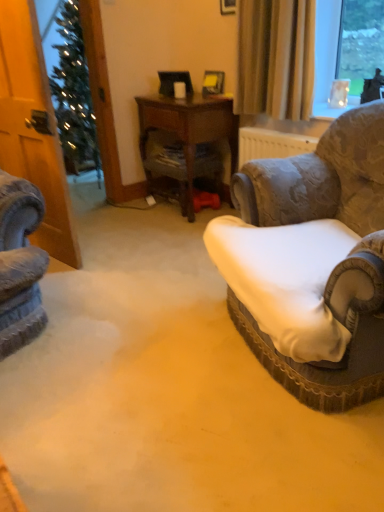
Question: Looking at their shapes, would you say beige fabric curtain at upper right is wider or thinner than velvet-patterned armchair at right?

Choices:
 (A) thin
 (B) wide

Answer: (A)

Question: Is beige fabric curtain at upper right taller or shorter than velvet-patterned armchair at right?

Choices:
 (A) tall
 (B) short

Answer: (B)

Question: Which of these objects is positioned closest to the wooden desk at center?

Choices:
 (A) velvet-patterned armchair at right
 (B) beige fabric curtain at upper right
 (C) white fabric cushion at right

Answer: (B)

Question: Which of these objects is positioned closest to the wooden desk at center?

Choices:
 (A) beige fabric curtain at upper right
 (B) white fabric cushion at right
 (C) velvet-patterned armchair at right

Answer: (A)